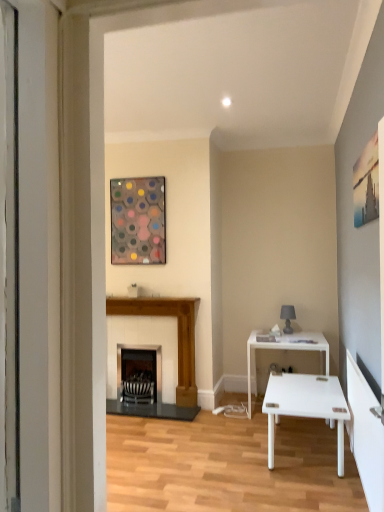
Question: Considering the positions of black striped fireplace at center, the first fireplace positioned from the left, and wooden fireplace at center, arranged as the 2th fireplace when viewed from the left, in the image, is black striped fireplace at center, the first fireplace positioned from the left, wider or thinner than wooden fireplace at center, arranged as the 2th fireplace when viewed from the left,?

Choices:
 (A) wide
 (B) thin

Answer: (B)

Question: From a real-world perspective, is black striped fireplace at center, the first fireplace positioned from the left, physically located above or below wooden fireplace at center, arranged as the 2th fireplace when viewed from the left?

Choices:
 (A) below
 (B) above

Answer: (A)

Question: Which of these objects is positioned farthest from the wooden fireplace at center, which is counted as the 1th fireplace, starting from the right?

Choices:
 (A) white glossy table at right
 (B) matte gray lampshade at right
 (C) metallic hexagonal artwork at upper center
 (D) black striped fireplace at center, the first fireplace positioned from the left

Answer: (B)

Question: Estimate the real-world distances between objects in this image. Which object is farther from the matte gray lampshade at right?

Choices:
 (A) metallic hexagonal artwork at upper center
 (B) white glossy table at right
 (C) wooden fireplace at center, which is counted as the 1th fireplace, starting from the right
 (D) black striped fireplace at center, the first fireplace positioned from the left

Answer: (A)